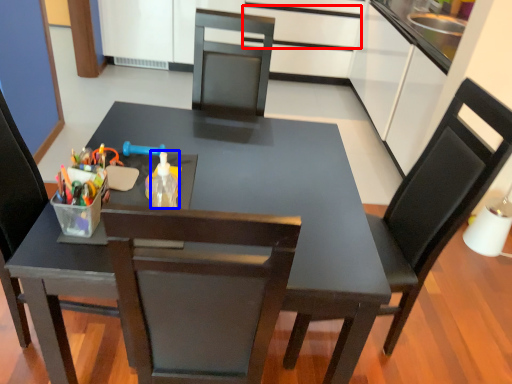
Question: Which object is closer to the camera taking this photo, drawer (highlighted by a red box) or bottle (highlighted by a blue box)?

Choices:
 (A) drawer
 (B) bottle

Answer: (B)